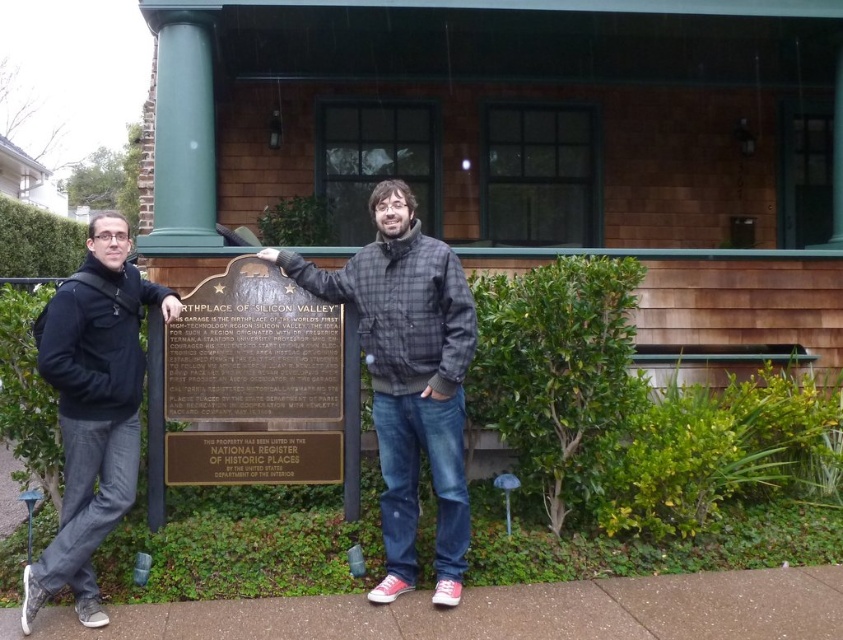
Which is behind, point (455, 541) or point (86, 417)?

The point (455, 541) is more distant.

Does plaid jacket at center come behind black matte jacket at left?

Yes.

This screenshot has width=843, height=640. What do you see at coordinates (407, 378) in the screenshot?
I see `plaid jacket at center` at bounding box center [407, 378].

This screenshot has height=640, width=843. What are the coordinates of `plaid jacket at center` in the screenshot? It's located at (407, 378).

Describe the element at coordinates (407, 376) in the screenshot. This screenshot has height=640, width=843. I see `matte black jacket at center` at that location.

Is matte black jacket at center in front of brown shingles at center?

Yes, it is.

This screenshot has width=843, height=640. What do you see at coordinates (407, 376) in the screenshot?
I see `matte black jacket at center` at bounding box center [407, 376].

Locate an element on the screen. This screenshot has width=843, height=640. matte black jacket at center is located at coordinates (407, 376).

Between matte black jacket at center and gold-bronze plaque at center, which one has more height?

Standing taller between the two is matte black jacket at center.

Measure the distance between matte black jacket at center and camera.

matte black jacket at center and camera are 3.76 meters apart from each other.

The width and height of the screenshot is (843, 640). Identify the location of matte black jacket at center. (407, 376).